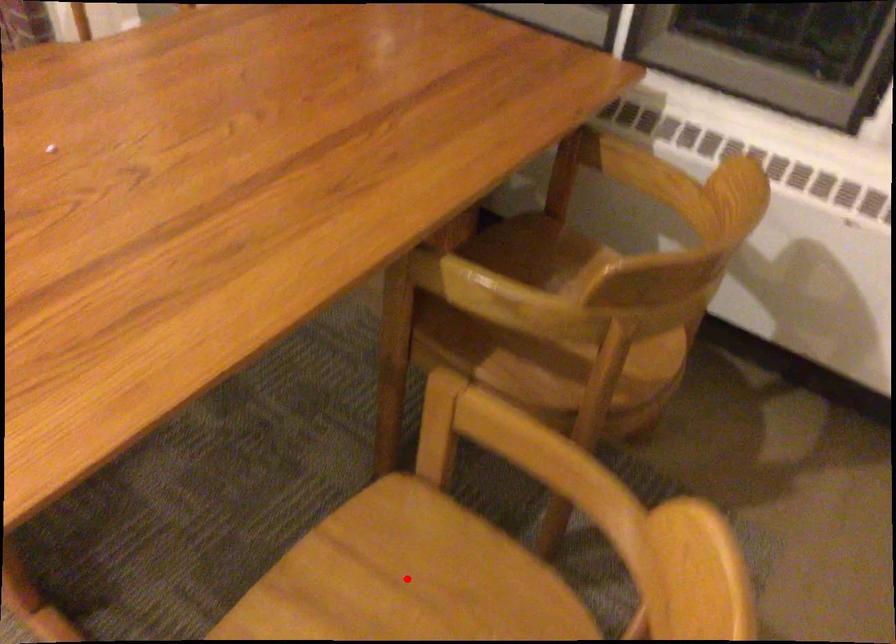
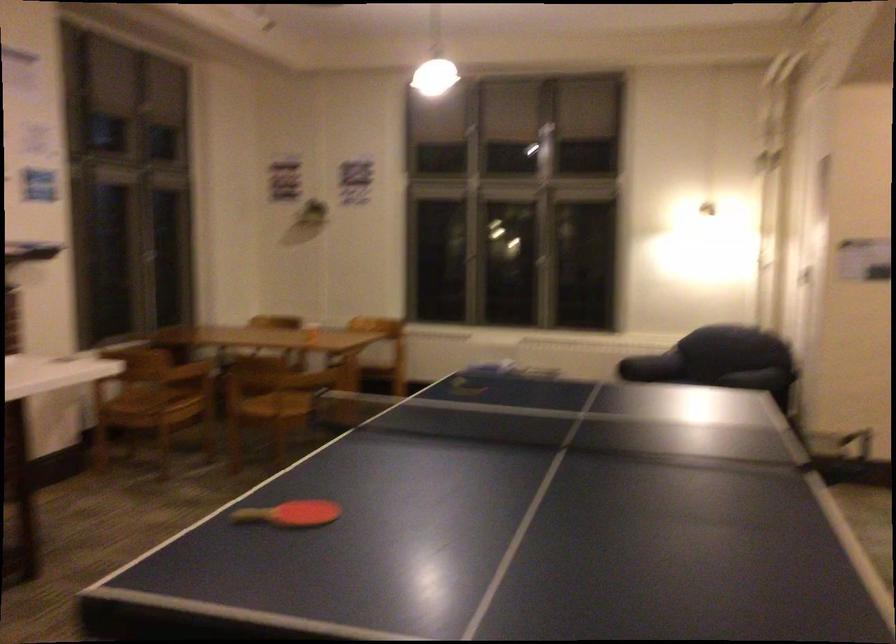
Question: I am providing you with two images of the same scene from different viewpoints. A red point is marked on the first image. Is the red point's position out of view in image 2?

Choices:
 (A) Yes
 (B) No

Answer: (A)